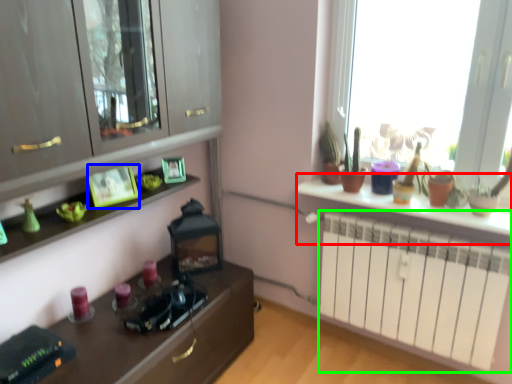
Question: Based on their relative distances, which object is nearer to table (highlighted by a red box)? Choose from picture frame (highlighted by a blue box) and radiator (highlighted by a green box).

Choices:
 (A) picture frame
 (B) radiator

Answer: (B)